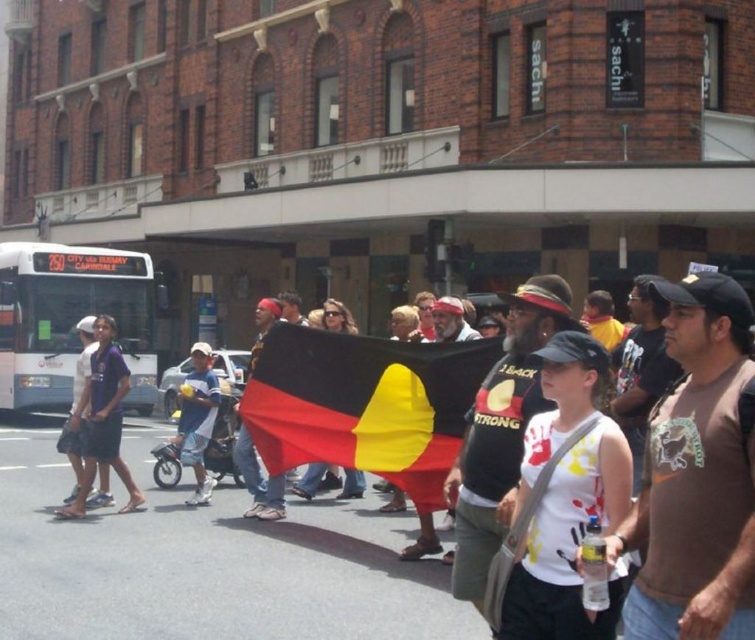
Question: Does brown cotton t-shirt at center-right appear over black fabric flag at center?

Choices:
 (A) yes
 (B) no

Answer: (A)

Question: Does black fabric flag at center come in front of dark blue jeans at left?

Choices:
 (A) yes
 (B) no

Answer: (A)

Question: Where is brown cotton t-shirt at center-right located in relation to dark blue shorts at left in the image?

Choices:
 (A) below
 (B) above

Answer: (B)

Question: Which point is closer to the camera?

Choices:
 (A) (31, 268)
 (B) (205, 442)
 (C) (82, 406)

Answer: (C)

Question: Which point is farther to the camera?

Choices:
 (A) brown cotton t-shirt at center-right
 (B) white metallic bus at left
 (C) black fabric flag at center
 (D) dark blue jeans at left

Answer: (B)

Question: Among these points, which one is farthest from the camera?

Choices:
 (A) (2, 289)
 (B) (663, 625)

Answer: (A)